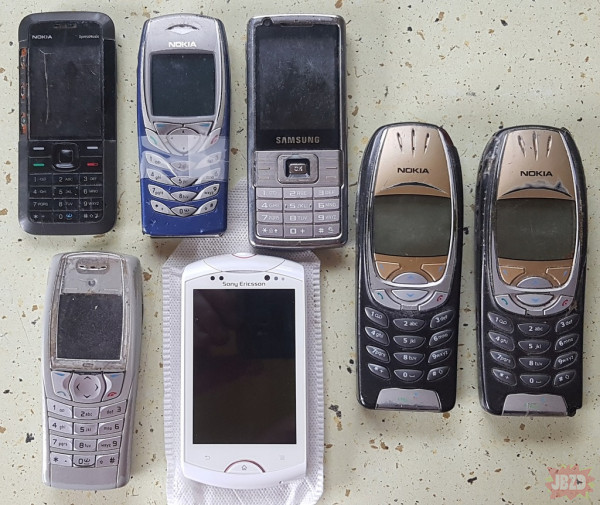
Where is `phones`? phones is located at coordinates (86, 175), (203, 173), (271, 143), (250, 365), (87, 366), (378, 318), (542, 328).